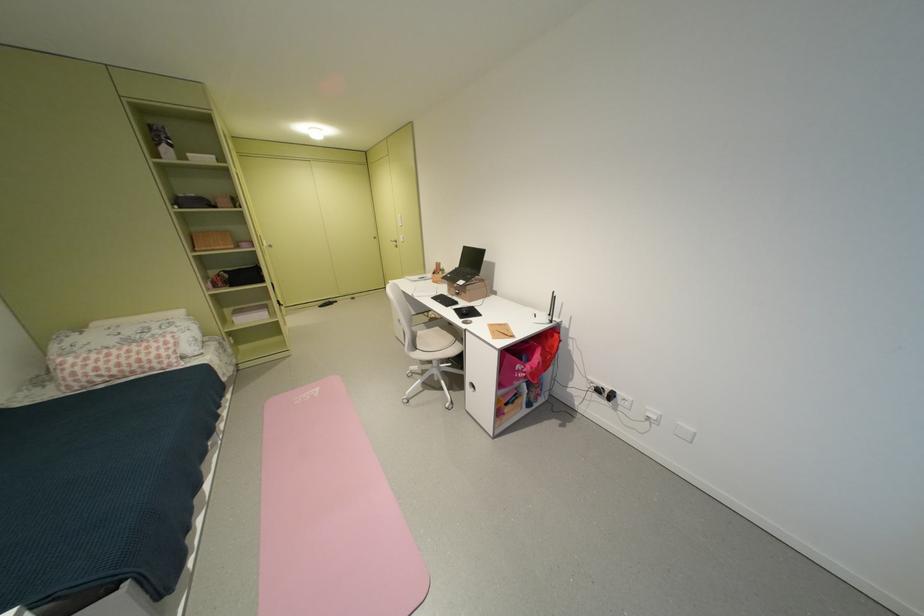
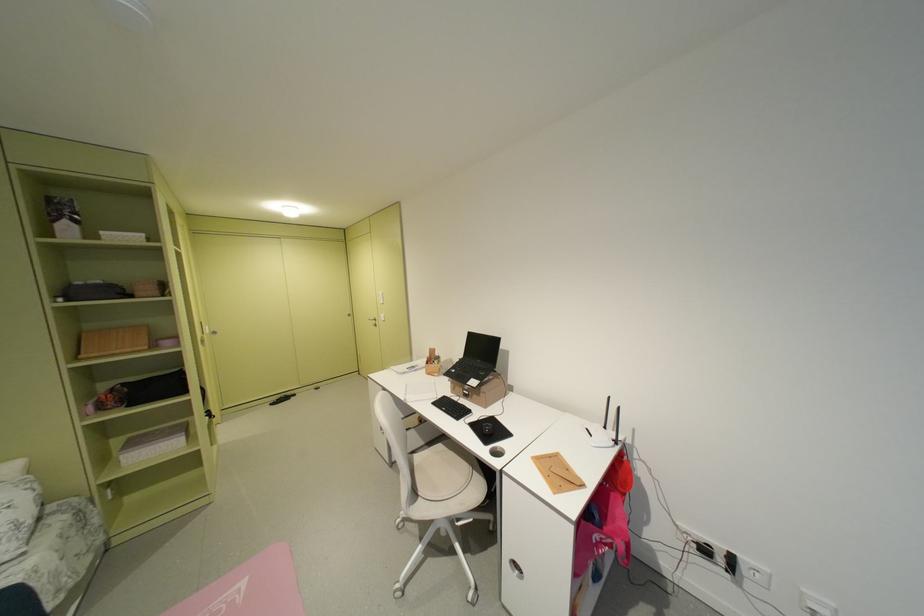
Question: How did the camera likely rotate?

Choices:
 (A) Left
 (B) Right
 (C) Up
 (D) Down

Answer: (C)